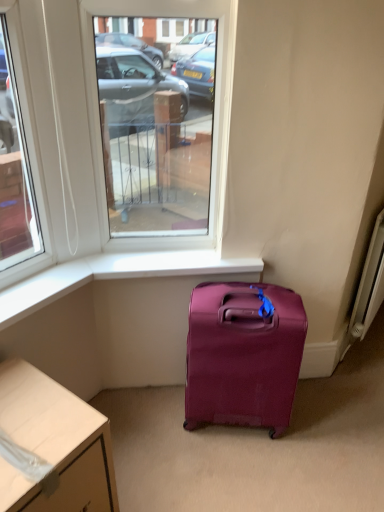
In order to click on free spot above white smooth window sill at lower center (from a real-world perspective) in this screenshot , I will do `click(167, 257)`.